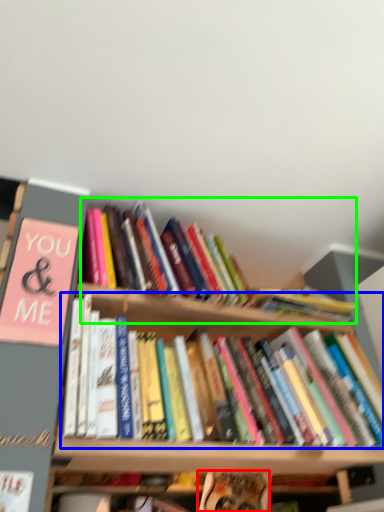
Question: Based on their relative distances, which object is farther from book (highlighted by a red box)? Choose from book (highlighted by a blue box) and book (highlighted by a green box).

Choices:
 (A) book
 (B) book

Answer: (B)